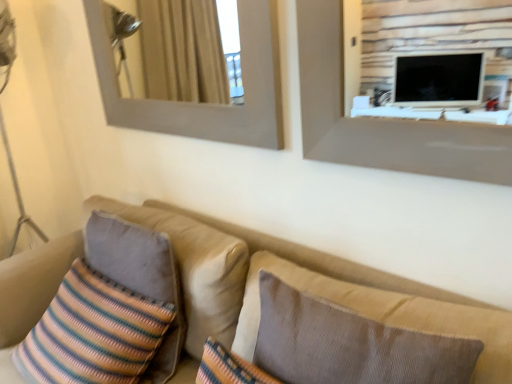
Question: Is brown textured pillow at center, which appears as the second pillow when viewed from the back, shorter than striped fabric pillow at lower left?

Choices:
 (A) yes
 (B) no

Answer: (A)

Question: Is brown textured pillow at center, the second pillow when ordered from left to right, outside of striped fabric pillow at lower left?

Choices:
 (A) yes
 (B) no

Answer: (A)

Question: Is brown textured pillow at center, which appears as the second pillow when viewed from the back, looking in the opposite direction of striped fabric pillow at lower left?

Choices:
 (A) no
 (B) yes

Answer: (A)

Question: Is brown textured pillow at center, which appears as the second pillow when viewed from the back, aimed at striped fabric pillow at lower left?

Choices:
 (A) no
 (B) yes

Answer: (A)

Question: Is brown textured pillow at center, which appears as the second pillow when viewed from the back, not close to striped fabric pillow at lower left?

Choices:
 (A) no
 (B) yes

Answer: (A)

Question: From the image's perspective, is brown textured pillow at center, which is counted as the 1th pillow, starting from the right, located above striped fabric pillow at lower left?

Choices:
 (A) no
 (B) yes

Answer: (B)

Question: From the image's perspective, is striped fabric pillow at left, placed as the second pillow when sorted from right to left, over brown textured pillow at center, which is counted as the 1th pillow, starting from the right?

Choices:
 (A) yes
 (B) no

Answer: (A)

Question: From a real-world perspective, is striped fabric pillow at left, positioned as the 1th pillow in back-to-front order, physically below brown textured pillow at center, the second pillow when ordered from left to right?

Choices:
 (A) no
 (B) yes

Answer: (B)

Question: Does striped fabric pillow at left, which is the 1th pillow in left-to-right order, have a smaller size compared to brown textured pillow at center, arranged as the first pillow when viewed from the front?

Choices:
 (A) no
 (B) yes

Answer: (B)

Question: Is striped fabric pillow at left, which is the 1th pillow in left-to-right order, to the right of brown textured pillow at center, the second pillow when ordered from left to right, from the viewer's perspective?

Choices:
 (A) yes
 (B) no

Answer: (B)

Question: Can you confirm if striped fabric pillow at left, which is the 1th pillow in left-to-right order, is shorter than brown textured pillow at center, which appears as the second pillow when viewed from the back?

Choices:
 (A) yes
 (B) no

Answer: (A)

Question: Is the depth of striped fabric pillow at left, placed as the second pillow when sorted from right to left, less than that of brown textured pillow at center, which is counted as the 1th pillow, starting from the right?

Choices:
 (A) yes
 (B) no

Answer: (B)

Question: Does beige fabric couch at lower left appear on the right side of striped fabric pillow at left, positioned as the 1th pillow in back-to-front order?

Choices:
 (A) yes
 (B) no

Answer: (A)